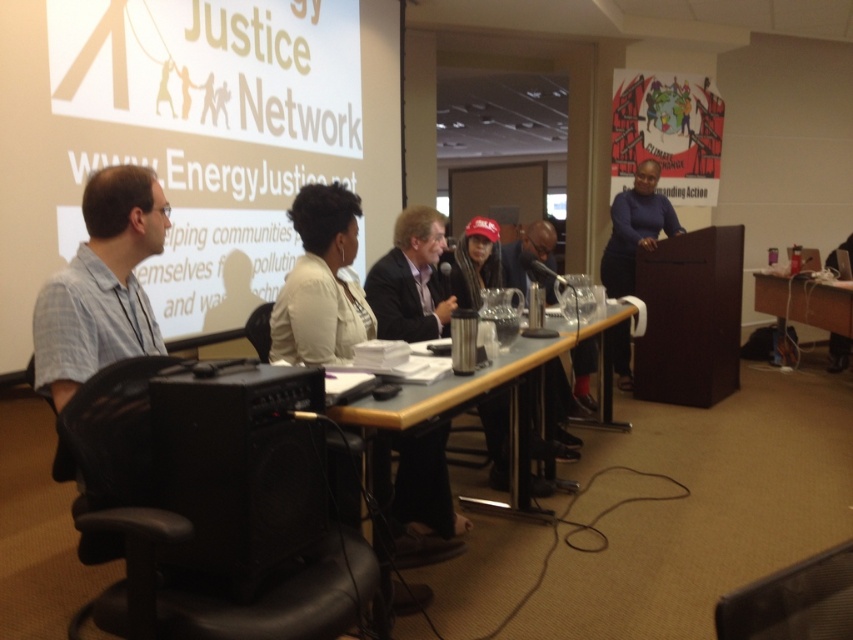
You are a photographer standing in the room and want to capture a photo of both the white fabric jacket at center and the wooden table at right. Which object will appear larger in the photo?

The white fabric jacket at center will appear larger in the photo because it is much taller than the wooden table at right.

Based on the photo, you are standing at the entrance of the conference room and see the black matte speaker at lower left and the wooden table at center. Which object is closer to your left side?

The black matte speaker at lower left is closer to your left side because it is positioned to the left of the wooden table at center.

You are setting up a presentation and need to place the black matte speaker at lower left and the wooden table at right in a way that the speaker is visible to the audience. Given their heights, which object should be placed closer to the front of the room?

The black matte speaker at lower left is not as tall as the wooden table at right, so to ensure visibility, the speaker should be placed closer to the front of the room.